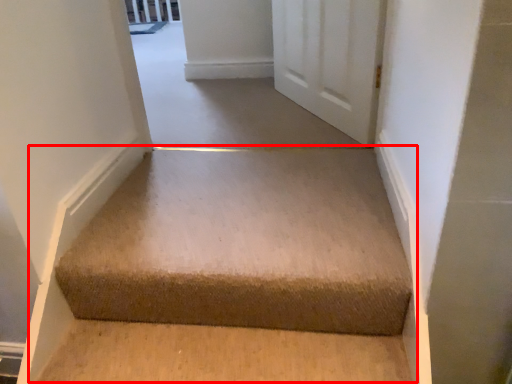
Question: Considering the relative positions of stairwell (annotated by the red box) and passage in the image provided, where is stairwell (annotated by the red box) located with respect to the staircase?

Choices:
 (A) left
 (B) right

Answer: (B)